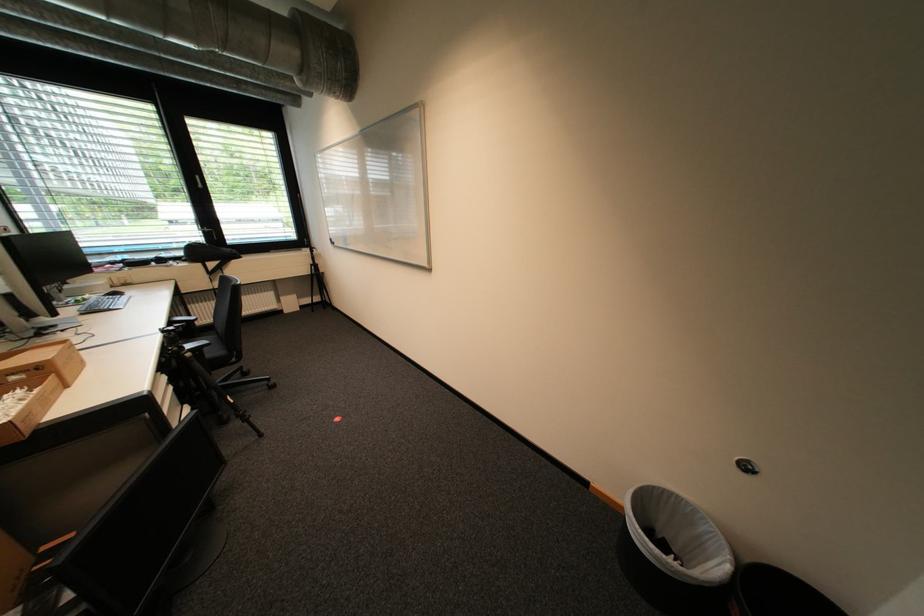
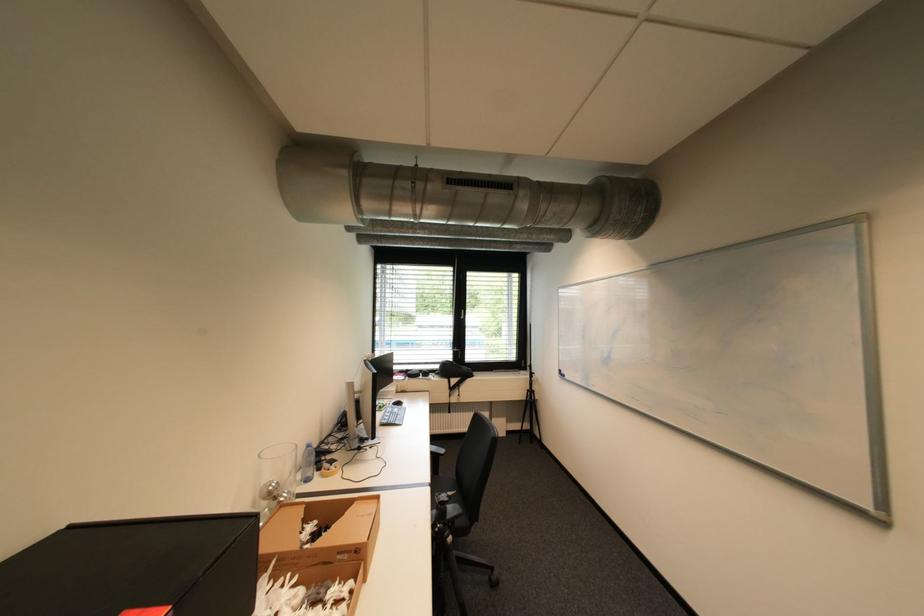
Find the pixel in the second image that matches the point at 188,253 in the first image.

(445, 368)